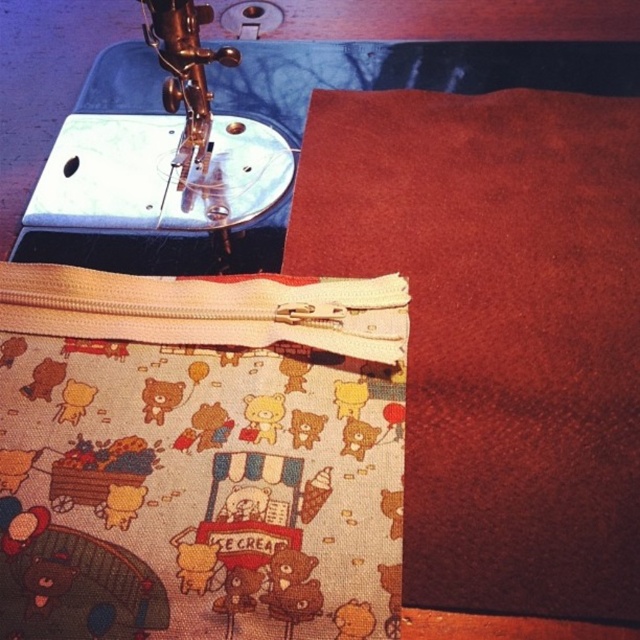
You are organizing a sewing kit and need to place the beige fabric pouch at center and the matte brown fabric at center into a storage box. Which object should you place first to ensure the one behind is visible?

You should place the beige fabric pouch at center first since it is in front of the matte brown fabric at center, allowing the brown fabric to be visible behind it.

In the scene shown: You are a tailor who needs to reach the matte brown fabric at center from your current position. The tailor robot you are using has a maximum reach of 50 centimeters. Can the robot extend its arm far enough to grab the fabric?

The distance between the matte brown fabric at center and the camera is 52.48 centimeters, which exceeds the robot arm reach of 50 centimeters. The robot cannot grab the fabric.